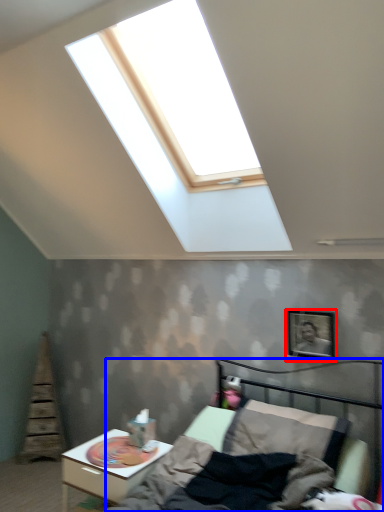
Question: Among these objects, which one is nearest to the camera, picture frame (highlighted by a red box) or bed (highlighted by a blue box)?

Choices:
 (A) picture frame
 (B) bed

Answer: (B)